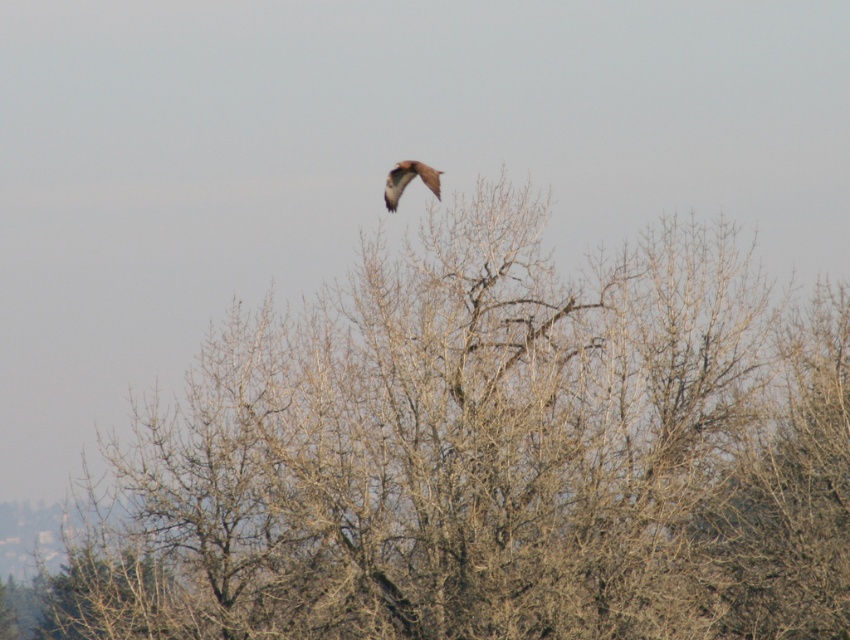
You are an ornithologist observing a bird in flight. You note the bird is at coordinates approximately 0.5, 0.5 in the frame. Where are the bare branches at center located relative to the bird?

The bare branches at center are located at coordinates (488, 456), which is to the right and slightly above the bird at (425, 320).

You are a birdwatcher observing the scene. You notice the brown feathered bird at upper center and the bare branches at center. Which object is positioned more to the left in the image?

The brown feathered bird at upper center is positioned more to the left than the bare branches at center.

You are an ornithologist observing the scene. You notice the brown feathered bird at upper center and the bare branches at center. Which object would block your view of the other if they are aligned along the same line of sight?

The bare branches at center would block the view of the brown feathered bird at upper center because it is larger in size.